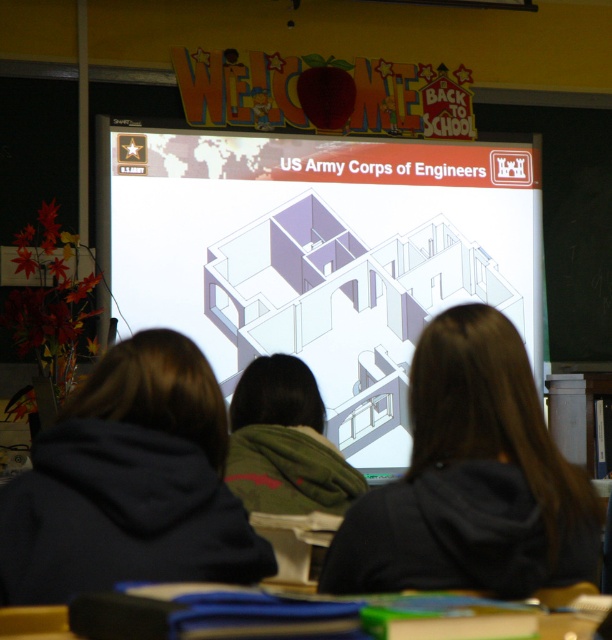
In the classroom scene, there is a white glossy projection screen at upper center and a black matte hair at center. Based on their positions, which object is located to the right side?

The black matte hair at center is located to the right of the white glossy projection screen at upper center.

You are standing at the back of the classroom and want to walk to the point marked as point (184, 516). However, there is an obstacle at point (506, 451). Will you encounter this obstacle on your path?

Since point (184, 516) is in front of point (506, 451), you will reach point (184, 516) before encountering the obstacle at point (506, 451).